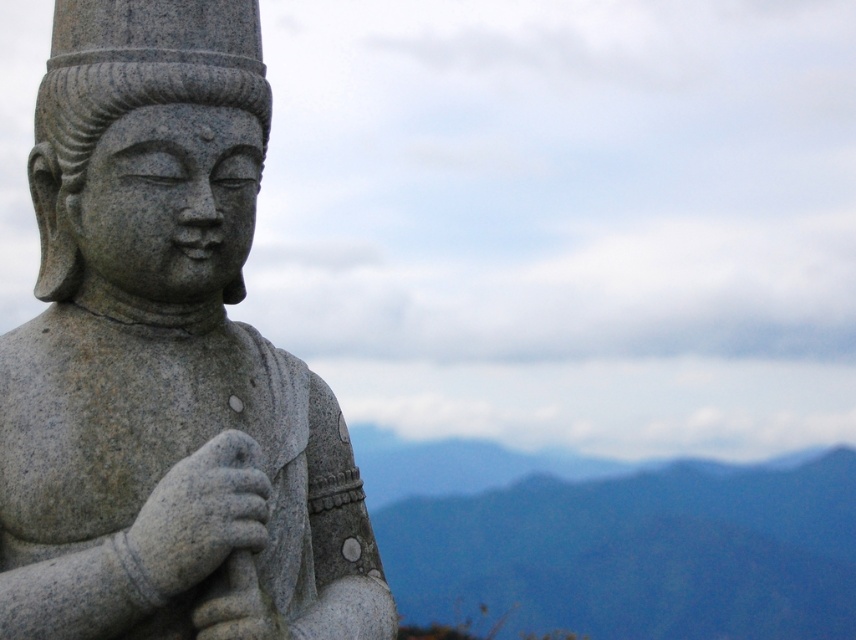
From the picture: You are a photographer taking a close up of the statue. You want to focus on the point closer to the camera between the two points point (x=272, y=403) and point (x=500, y=572). Which point should you choose?

Point (x=272, y=403) is closer to the camera than point (x=500, y=572), so you should focus on point (x=272, y=403).